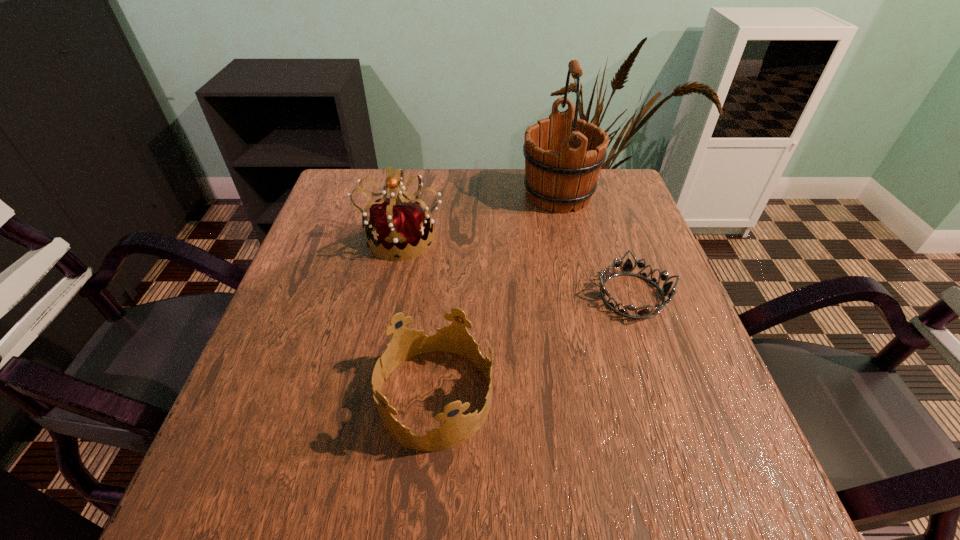
At what (x,y) coordinates should I click in order to perform the action: click on vacant space that satisfies the following two spatial constraints: 1. on the front-facing side of the rightmost tiara; 2. on the front-facing side of the second shortest object. Please return your answer as a coordinate pair (x, y). Looking at the image, I should click on (667, 397).

Where is `free point that satisfies the following two spatial constraints: 1. on the front-facing side of the second nearest object; 2. on the front-facing side of the second tallest tiara`? The height and width of the screenshot is (540, 960). free point that satisfies the following two spatial constraints: 1. on the front-facing side of the second nearest object; 2. on the front-facing side of the second tallest tiara is located at coordinates (667, 397).

Where is `vacant space that satisfies the following two spatial constraints: 1. on the front side of the tallest object; 2. on the front-facing side of the nearest object`? Image resolution: width=960 pixels, height=540 pixels. vacant space that satisfies the following two spatial constraints: 1. on the front side of the tallest object; 2. on the front-facing side of the nearest object is located at coordinates (604, 397).